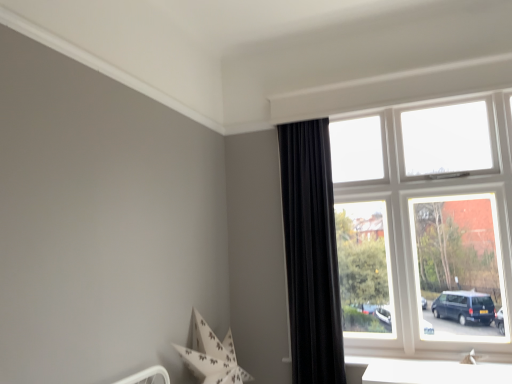
Question: Would you say white frame window at upper right is part of black velvet curtain at right's contents?

Choices:
 (A) no
 (B) yes

Answer: (A)

Question: From a real-world perspective, is black velvet curtain at right physically below white frame window at upper right?

Choices:
 (A) no
 (B) yes

Answer: (B)

Question: From a real-world perspective, is black velvet curtain at right on white frame window at upper right?

Choices:
 (A) yes
 (B) no

Answer: (B)

Question: Is black velvet curtain at right thinner than white frame window at upper right?

Choices:
 (A) no
 (B) yes

Answer: (A)

Question: Is black velvet curtain at right far away from white frame window at upper right?

Choices:
 (A) no
 (B) yes

Answer: (A)

Question: Does black velvet curtain at right turn towards white frame window at upper right?

Choices:
 (A) no
 (B) yes

Answer: (A)

Question: Considering the relative sizes of white frame window at upper right and black velvet curtain at right in the image provided, is white frame window at upper right smaller than black velvet curtain at right?

Choices:
 (A) yes
 (B) no

Answer: (B)

Question: Is white frame window at upper right turned away from black velvet curtain at right?

Choices:
 (A) no
 (B) yes

Answer: (A)

Question: Does white frame window at upper right contain black velvet curtain at right?

Choices:
 (A) yes
 (B) no

Answer: (B)

Question: From a real-world perspective, is white frame window at upper right positioned over black velvet curtain at right based on gravity?

Choices:
 (A) yes
 (B) no

Answer: (A)

Question: Is white frame window at upper right at the right side of black velvet curtain at right?

Choices:
 (A) no
 (B) yes

Answer: (B)

Question: Could you tell me if white frame window at upper right is facing black velvet curtain at right?

Choices:
 (A) yes
 (B) no

Answer: (B)

Question: Considering their positions, is white frame window at upper right located in front of or behind black velvet curtain at right?

Choices:
 (A) behind
 (B) front

Answer: (B)